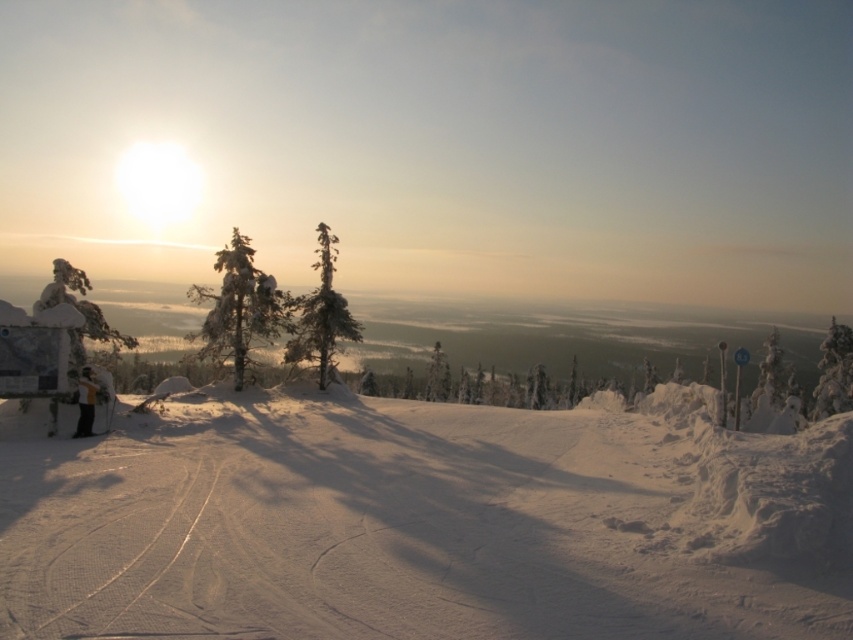
Question: Does white powdery snow at center appear on the right side of white frosty tree at right?

Choices:
 (A) no
 (B) yes

Answer: (A)

Question: Among these points, which one is farthest from the camera?

Choices:
 (A) (323, 364)
 (B) (842, 369)

Answer: (B)

Question: Does snow-covered pine at center have a lesser width compared to green matte tree at center?

Choices:
 (A) yes
 (B) no

Answer: (B)

Question: Among these points, which one is farthest from the camera?

Choices:
 (A) tap(90, 372)
 (B) tap(822, 371)
 (C) tap(776, 392)
 (D) tap(444, 388)

Answer: (B)

Question: Which object is farther from the camera taking this photo?

Choices:
 (A) snow-covered evergreen tree at center
 (B) green matte tree at center

Answer: (B)

Question: Does white powdery snow at center appear under green matte tree at center?

Choices:
 (A) yes
 (B) no

Answer: (B)